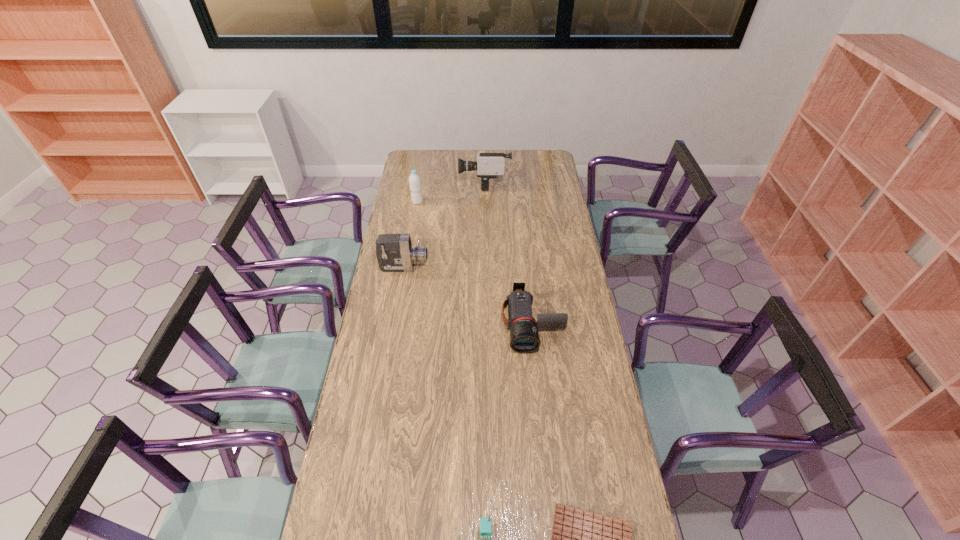
Locate an element on the screen. Image resolution: width=960 pixels, height=540 pixels. free spot between the fifth nearest object and the tallest camcorder is located at coordinates (451, 192).

Where is `free space between the second tallest camcorder and the second farthest object`? The height and width of the screenshot is (540, 960). free space between the second tallest camcorder and the second farthest object is located at coordinates (411, 234).

The height and width of the screenshot is (540, 960). In order to click on free space between the fourth farthest object and the fourth nearest object in this screenshot , I will do `click(468, 295)`.

Locate an element on the screen. The height and width of the screenshot is (540, 960). empty space between the farthest camcorder and the second tallest camcorder is located at coordinates (444, 225).

Identify the location of vacant space that is in between the fourth nearest object and the shortest camcorder. The image size is (960, 540). (468, 295).

The height and width of the screenshot is (540, 960). I want to click on free space between the shortest camcorder and the second nearest camcorder, so click(x=468, y=295).

You are a GUI agent. You are given a task and a screenshot of the screen. Output one action in this format:
    pyautogui.click(x=<x>, y=<y>)
    Task: Click on the third closest object relative to the farthest object
    
    Given the screenshot: What is the action you would take?
    pyautogui.click(x=524, y=336)

Locate which object ranks third in proximity to the notebook. Please provide its 2D coordinates. Your answer should be formatted as a tuple, i.e. [(x, y)], where the tuple contains the x and y coordinates of a point satisfying the conditions above.

[(394, 252)]

Where is `camcorder that stands as the closest to the fourth nearest object`? camcorder that stands as the closest to the fourth nearest object is located at coordinates (524, 336).

Identify the location of camcorder that is the second closest to the farthest object. (524, 336).